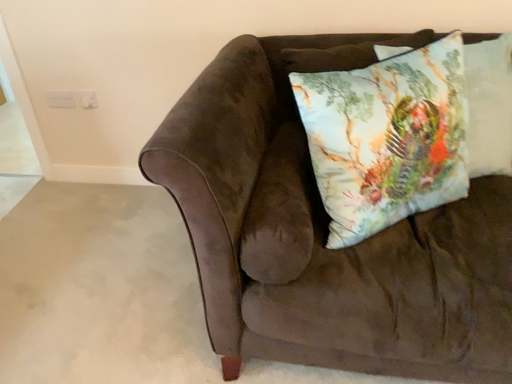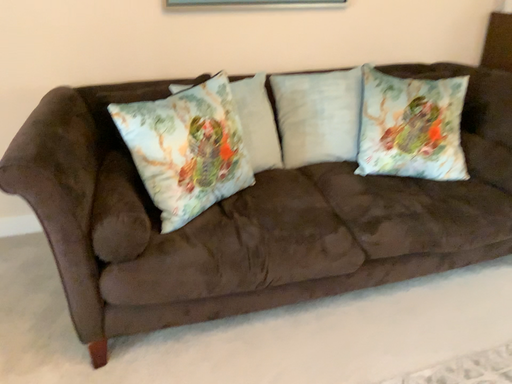
Question: How did the camera likely rotate when shooting the video?

Choices:
 (A) rotated right
 (B) rotated left

Answer: (A)